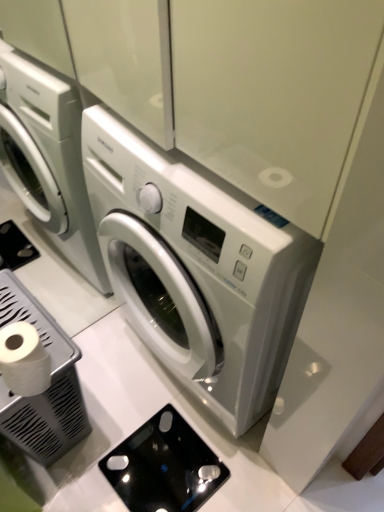
Where is `vacant area located to the right-hand side of white plastic trash can at lower left, which ranks as the 2th appliance in right-to-left order`? This screenshot has height=512, width=384. vacant area located to the right-hand side of white plastic trash can at lower left, which ranks as the 2th appliance in right-to-left order is located at coordinates (131, 411).